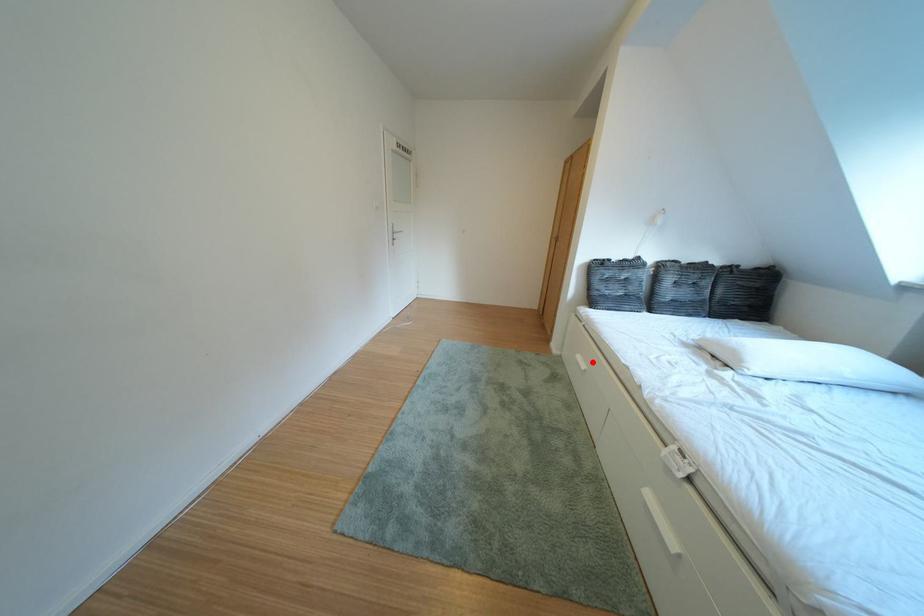
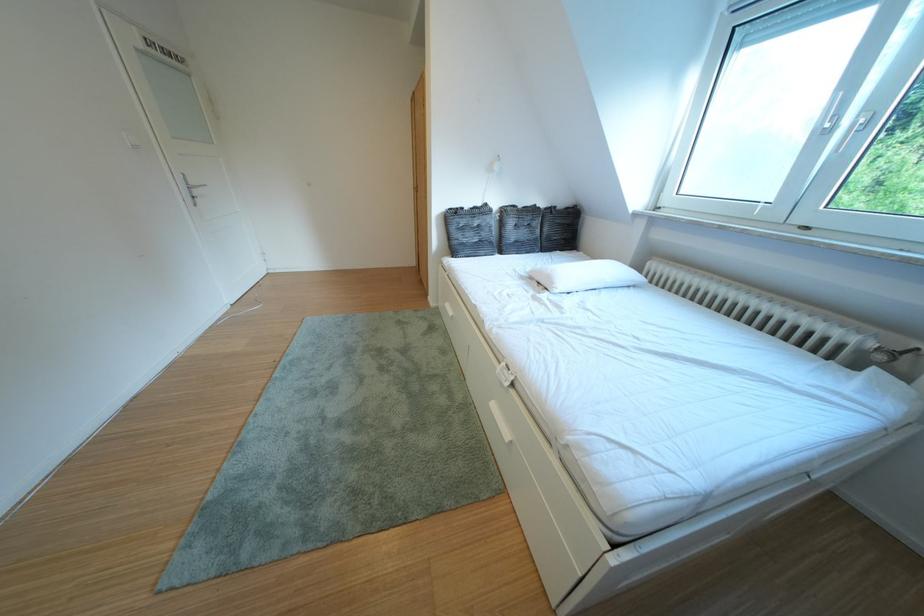
Locate, in the second image, the point that corresponds to the highlighted location in the first image.

(460, 310)